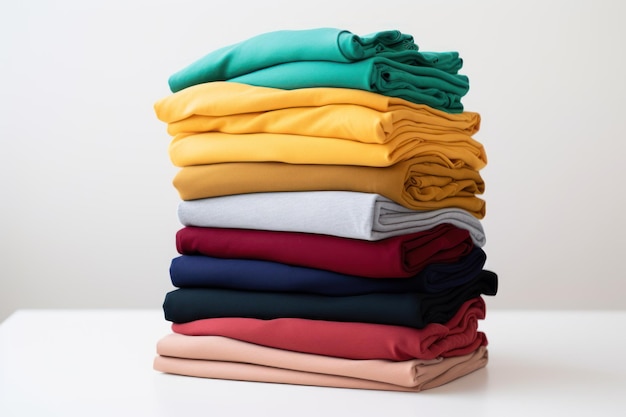
Find the location of a particular element. This screenshot has width=626, height=417. stack of towels is located at coordinates (274, 364), (294, 338), (250, 303), (244, 283), (290, 256), (307, 218), (237, 169), (249, 119), (257, 85).